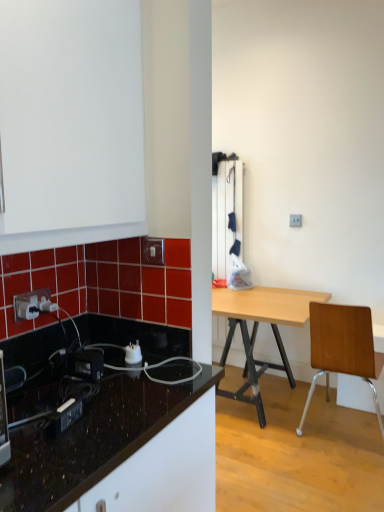
In order to click on free space below brown wooden chair at right (from a real-world perspective) in this screenshot , I will do `click(338, 428)`.